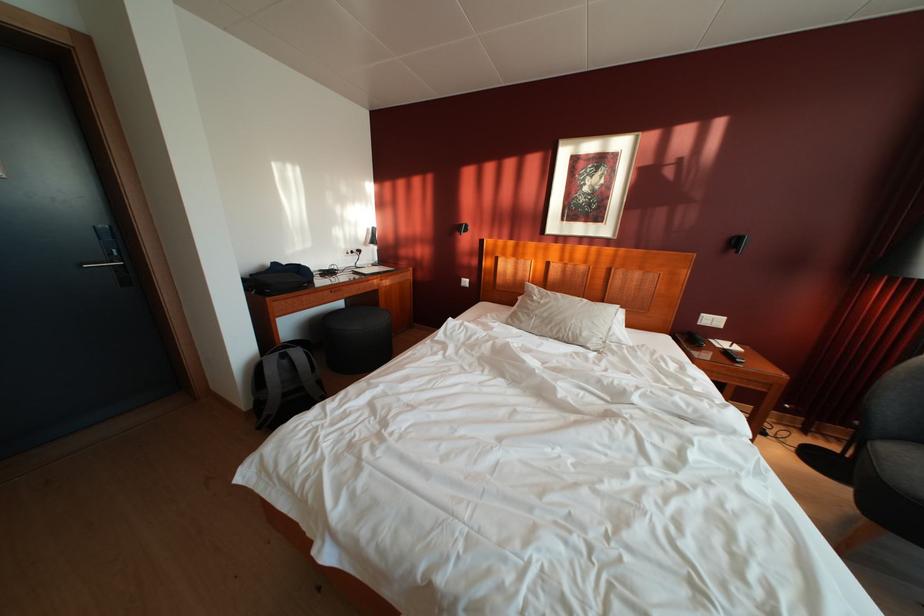
At what (x,y) coordinates should I click in order to perform the action: click on black remote control. Please return your answer as a coordinate pair (x, y). Looking at the image, I should click on (733, 355).